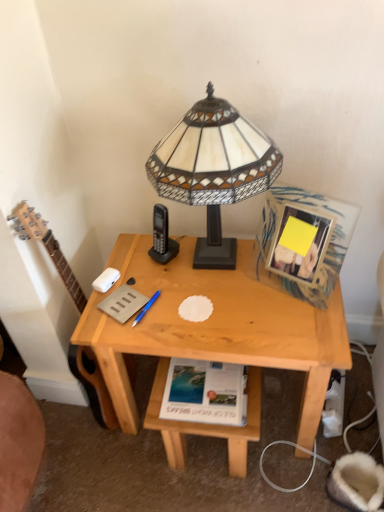
The height and width of the screenshot is (512, 384). I want to click on blank space to the left of wooden acoustic guitar at left, so click(x=62, y=424).